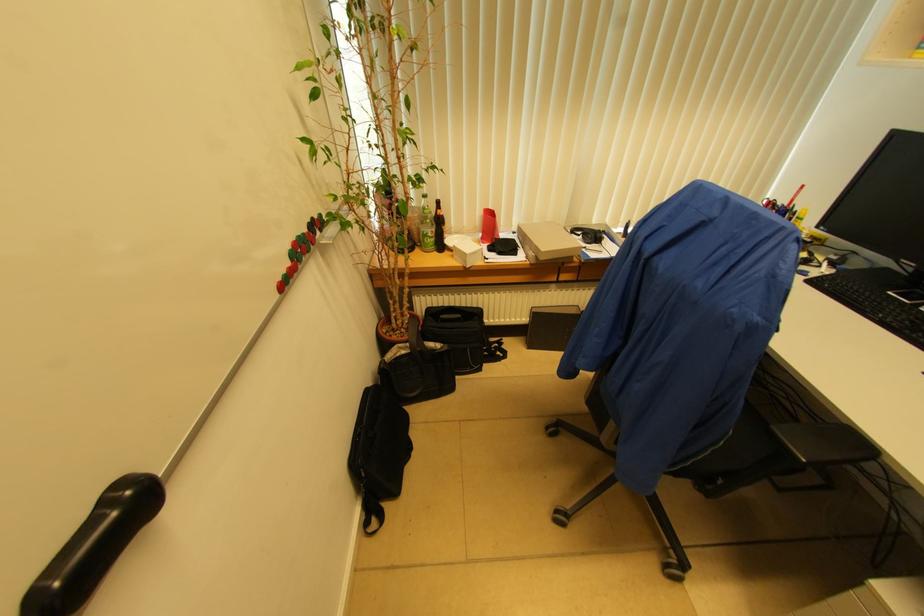
Where is `black eraser handle`? black eraser handle is located at coordinates tap(94, 546).